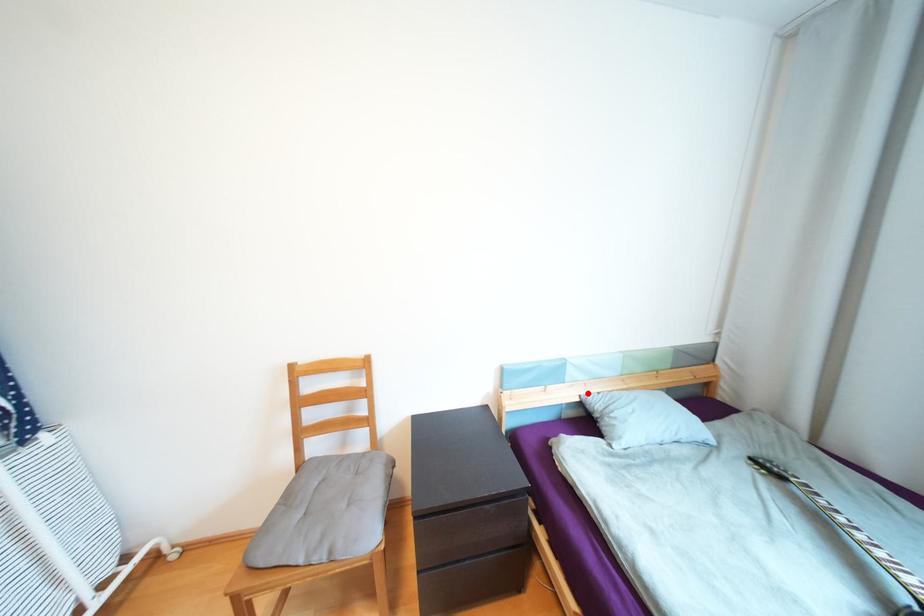
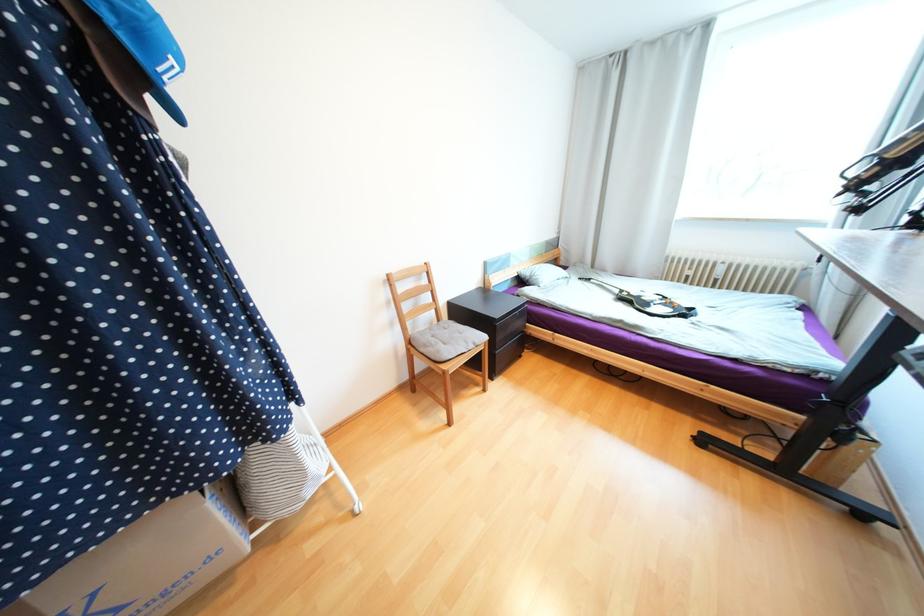
Locate, in the second image, the point that corresponds to the highlighted location in the first image.

(524, 270)